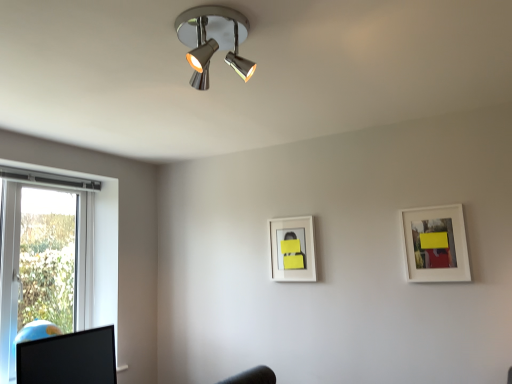
Question: Is white matte picture frame at upper right, placed as the 2th picture frame when sorted from back to front, beside white matte picture frame at center, the first picture frame when ordered from left to right?

Choices:
 (A) yes
 (B) no

Answer: (B)

Question: Is white matte picture frame at upper right, which appears as the second picture frame when viewed from the left, not within white matte picture frame at center, which is the second picture frame from right to left?

Choices:
 (A) yes
 (B) no

Answer: (A)

Question: Considering the relative sizes of white matte picture frame at upper right, placed as the 2th picture frame when sorted from back to front, and white matte picture frame at center, which is the second picture frame from front to back, in the image provided, is white matte picture frame at upper right, placed as the 2th picture frame when sorted from back to front, smaller than white matte picture frame at center, which is the second picture frame from front to back,?

Choices:
 (A) yes
 (B) no

Answer: (B)

Question: Is white matte picture frame at upper right, placed as the 2th picture frame when sorted from back to front, looking in the opposite direction of white matte picture frame at center, the first picture frame when ordered from left to right?

Choices:
 (A) yes
 (B) no

Answer: (B)

Question: Does white matte picture frame at upper right, arranged as the first picture frame when viewed from the right, have a lesser height compared to white matte picture frame at center, the first picture frame when ordered from left to right?

Choices:
 (A) no
 (B) yes

Answer: (A)

Question: Is white matte picture frame at upper right, arranged as the first picture frame when viewed from the right, wider or thinner than chrome/metallic spotlight at upper center?

Choices:
 (A) wide
 (B) thin

Answer: (B)

Question: Is white matte picture frame at upper right, which appears as the second picture frame when viewed from the left, taller or shorter than chrome/metallic spotlight at upper center?

Choices:
 (A) short
 (B) tall

Answer: (B)

Question: Considering the positions of point (454, 261) and point (179, 39), is point (454, 261) closer or farther from the camera than point (179, 39)?

Choices:
 (A) closer
 (B) farther

Answer: (B)

Question: Do you think white matte picture frame at upper right, arranged as the first picture frame when viewed from the right, is within chrome/metallic spotlight at upper center, or outside of it?

Choices:
 (A) outside
 (B) inside

Answer: (A)

Question: Do you think chrome/metallic spotlight at upper center is within black glossy computer monitor at lower left, or outside of it?

Choices:
 (A) outside
 (B) inside

Answer: (A)

Question: From the image's perspective, relative to black glossy computer monitor at lower left, is chrome/metallic spotlight at upper center above or below?

Choices:
 (A) below
 (B) above

Answer: (B)

Question: Considering the positions of chrome/metallic spotlight at upper center and black glossy computer monitor at lower left in the image, is chrome/metallic spotlight at upper center taller or shorter than black glossy computer monitor at lower left?

Choices:
 (A) tall
 (B) short

Answer: (B)

Question: Considering their positions, is chrome/metallic spotlight at upper center located in front of or behind black glossy computer monitor at lower left?

Choices:
 (A) front
 (B) behind

Answer: (A)

Question: Is white matte picture frame at upper right, which is the first picture frame from front to back, in front of or behind white matte picture frame at center, the first picture frame in the back-to-front sequence, in the image?

Choices:
 (A) front
 (B) behind

Answer: (A)

Question: Is white matte picture frame at upper right, placed as the 2th picture frame when sorted from back to front, wider or thinner than white matte picture frame at center, the first picture frame when ordered from left to right?

Choices:
 (A) thin
 (B) wide

Answer: (B)